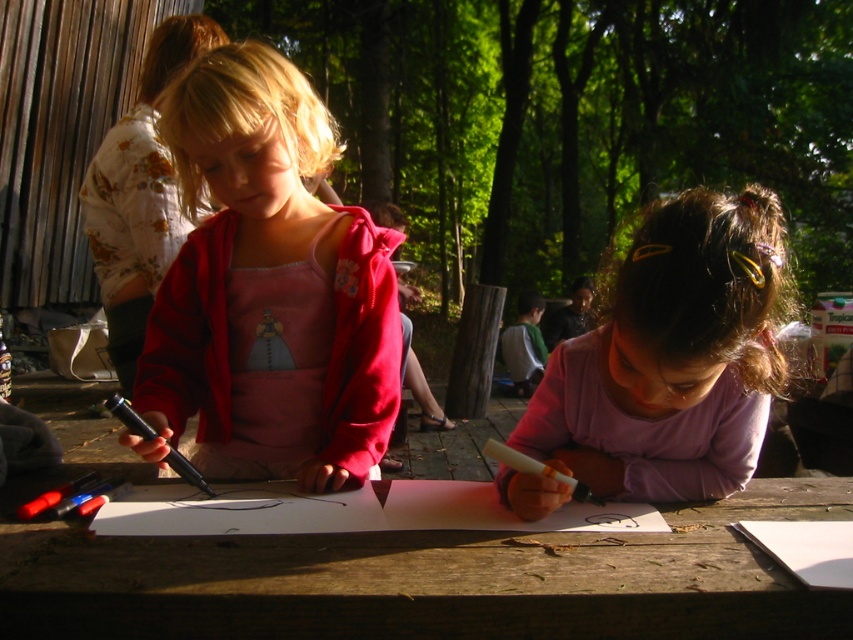
Is wooden table at center further to camera compared to matte pink hoodie at center?

No.

Is point (364, 577) in front of point (160, 339)?

Yes, point (364, 577) is in front of point (160, 339).

In order to click on wooden table at center in this screenshot , I will do `click(424, 579)`.

Does wooden table at center appear under purple matte shirt at center?

Indeed, wooden table at center is positioned under purple matte shirt at center.

Which is above, wooden table at center or purple matte shirt at center?

purple matte shirt at center

Is point (59, 525) less distant than point (662, 426)?

Yes, it is.

This screenshot has width=853, height=640. What are the coordinates of `wooden table at center` in the screenshot? It's located at (424, 579).

Is matte pink hoodie at center to the right of purple matte shirt at center from the viewer's perspective?

In fact, matte pink hoodie at center is to the left of purple matte shirt at center.

Can you confirm if matte pink hoodie at center is taller than purple matte shirt at center?

Correct, matte pink hoodie at center is much taller as purple matte shirt at center.

Which is in front, point (283, 445) or point (695, 428)?

Point (695, 428) is in front.

Locate an element on the screen. matte pink hoodie at center is located at coordinates (x=268, y=289).